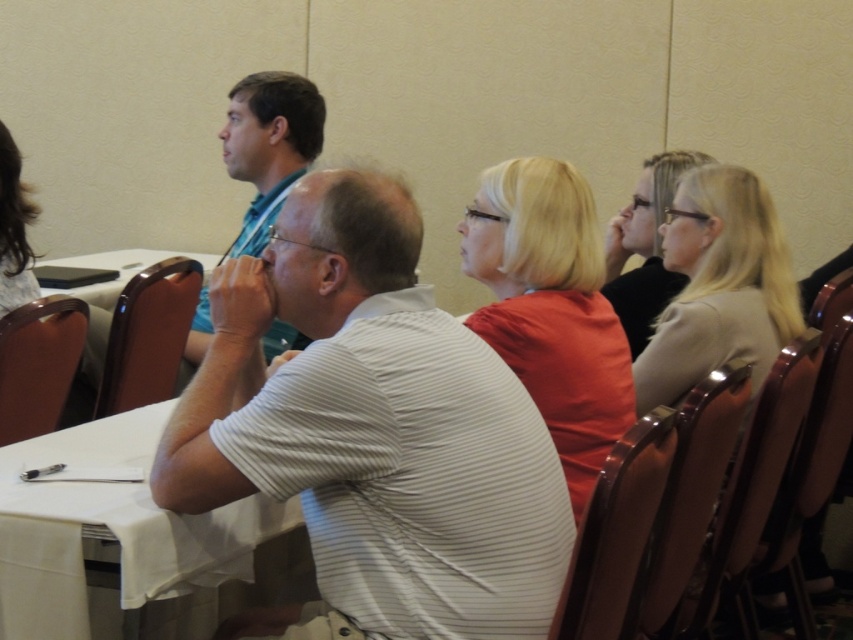
Question: Which of the following is the closest to the observer?

Choices:
 (A) white striped shirt at center
 (B) white plastic table at center
 (C) white cloth at lower left
 (D) matte teal shirt at upper left

Answer: (A)

Question: Which point is farther to the camera?

Choices:
 (A) (20, 566)
 (B) (296, 164)
 (C) (387, 538)
 (D) (202, 268)

Answer: (D)

Question: Is matte teal shirt at upper left further to camera compared to white plastic table at center?

Choices:
 (A) yes
 (B) no

Answer: (B)

Question: Which of the following is the closest to the observer?

Choices:
 (A) matte teal shirt at upper left
 (B) white cloth at lower left

Answer: (B)

Question: Does white striped shirt at center appear on the left side of matte teal shirt at upper left?

Choices:
 (A) no
 (B) yes

Answer: (A)

Question: Is white cloth at lower left in front of matte teal shirt at upper left?

Choices:
 (A) yes
 (B) no

Answer: (A)